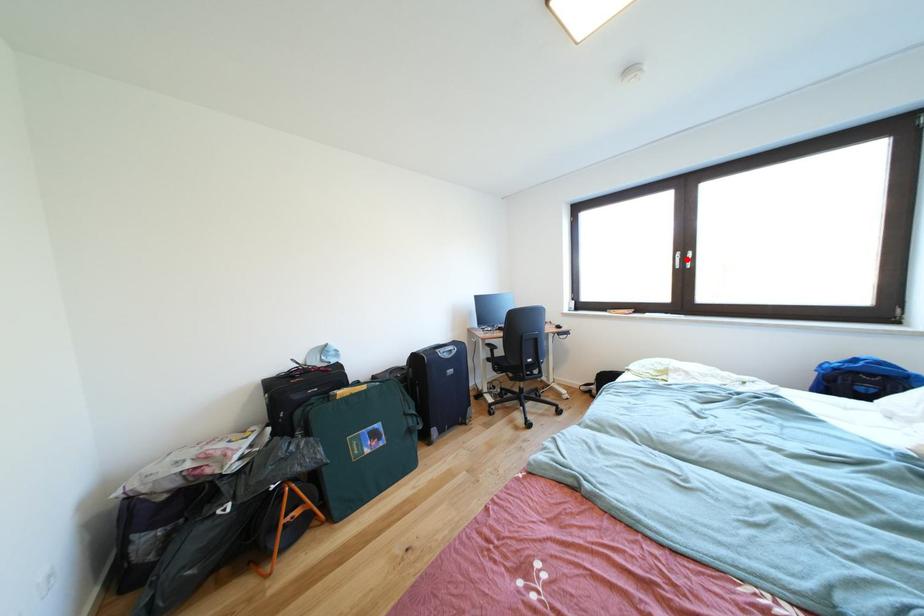
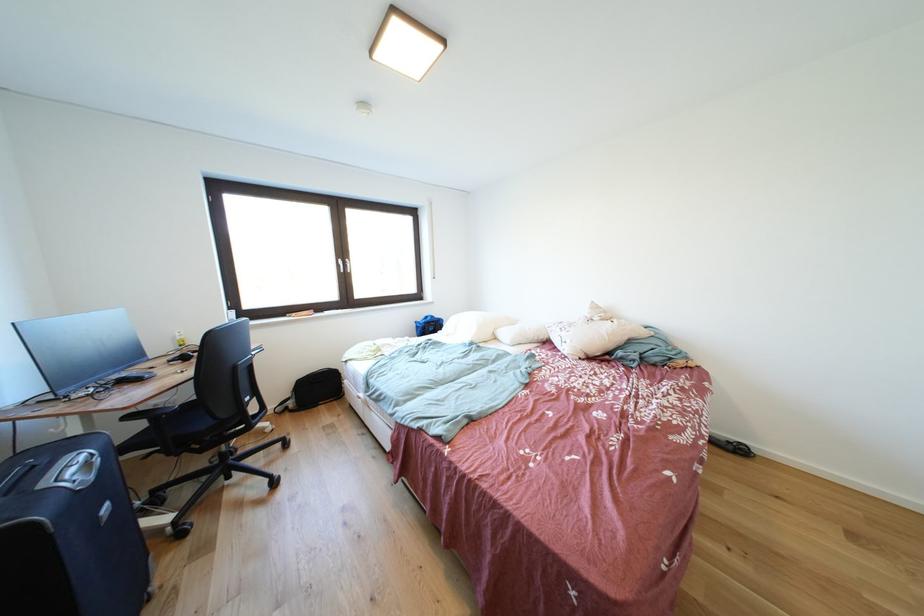
Where in the second image is the point corresponding to the highlighted location from the first image?

(348, 265)